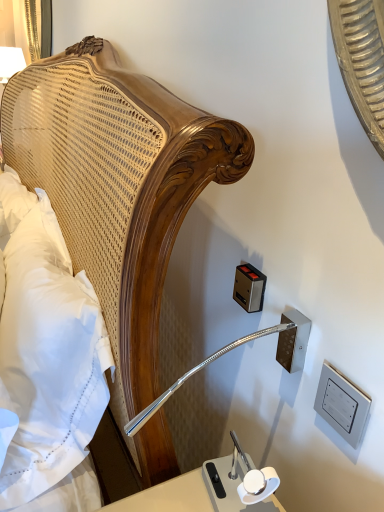
Question: Is metallic rectangular outlet at upper right, arranged as the 1th electric outlet when viewed from the left, bigger than metallic silver outlet at lower right, the second electric outlet positioned from the back?

Choices:
 (A) no
 (B) yes

Answer: (B)

Question: From the image's perspective, is metallic rectangular outlet at upper right, the 1th electric outlet in the back-to-front sequence, over metallic silver outlet at lower right, which is the second electric outlet in left-to-right order?

Choices:
 (A) no
 (B) yes

Answer: (B)

Question: Is the depth of metallic rectangular outlet at upper right, arranged as the 1th electric outlet when viewed from the left, less than that of metallic silver outlet at lower right, positioned as the first electric outlet in right-to-left order?

Choices:
 (A) yes
 (B) no

Answer: (B)

Question: Is metallic rectangular outlet at upper right, the second electric outlet when ordered from front to back, facing towards metallic silver outlet at lower right, positioned as the first electric outlet in front-to-back order?

Choices:
 (A) no
 (B) yes

Answer: (A)

Question: Can you confirm if metallic rectangular outlet at upper right, arranged as the 1th electric outlet when viewed from the left, is thinner than metallic silver outlet at lower right, positioned as the first electric outlet in front-to-back order?

Choices:
 (A) no
 (B) yes

Answer: (A)

Question: Is metallic rectangular outlet at upper right, the 1th electric outlet in the back-to-front sequence, not close to metallic silver outlet at lower right, positioned as the first electric outlet in front-to-back order?

Choices:
 (A) yes
 (B) no

Answer: (B)

Question: Can you confirm if white soft pillow at left is taller than metallic rectangular outlet at upper right, which ranks as the 2th electric outlet in right-to-left order?

Choices:
 (A) yes
 (B) no

Answer: (A)

Question: Does white soft pillow at left have a greater width compared to metallic rectangular outlet at upper right, the 1th electric outlet in the back-to-front sequence?

Choices:
 (A) yes
 (B) no

Answer: (A)

Question: Is white soft pillow at left not within metallic rectangular outlet at upper right, the second electric outlet when ordered from front to back?

Choices:
 (A) no
 (B) yes

Answer: (B)

Question: From the image's perspective, is white soft pillow at left on metallic rectangular outlet at upper right, arranged as the 1th electric outlet when viewed from the left?

Choices:
 (A) no
 (B) yes

Answer: (A)

Question: Is white soft pillow at left positioned before metallic rectangular outlet at upper right, arranged as the 1th electric outlet when viewed from the left?

Choices:
 (A) yes
 (B) no

Answer: (A)

Question: Is white soft pillow at left touching metallic rectangular outlet at upper right, the second electric outlet when ordered from front to back?

Choices:
 (A) yes
 (B) no

Answer: (B)

Question: Considering the relative sizes of metallic rectangular outlet at upper right, the second electric outlet when ordered from front to back, and white soft pillow at left in the image provided, is metallic rectangular outlet at upper right, the second electric outlet when ordered from front to back, smaller than white soft pillow at left?

Choices:
 (A) yes
 (B) no

Answer: (A)